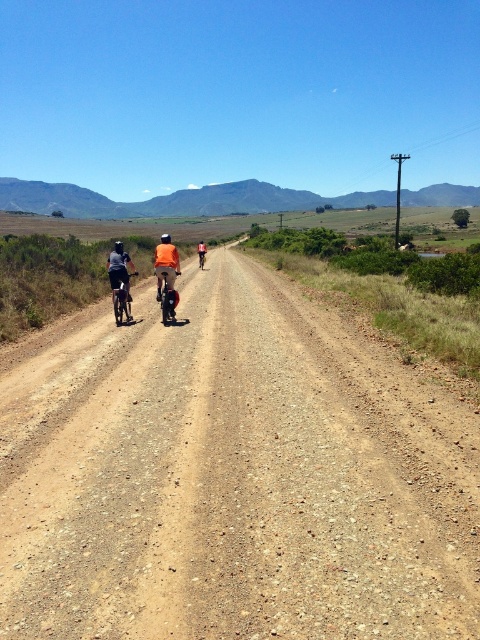
You are standing at the starting point of the dirt road and see the shiny metallic bicycle at center and the matte black bicycle at left. Which bicycle is closer to you?

The matte black bicycle at left is closer to you because the shiny metallic bicycle at center is located above it, indicating it is further along the road.

Looking at this image, you are a cyclist planning to ride along the brown gravel road at center. You notice the matte black bicycle at left parked on the side of the road. Can you safely ride your bicycle along the road without worrying about the width of the road being too narrow?

The brown gravel road at center is wider than the matte black bicycle at left, so the road is wide enough to safely ride your bicycle along it.

You are a hiker standing on the brown gravel road at center and want to reach the matte black bicycle at left. Which direction should you move to get there?

The brown gravel road at center is below the matte black bicycle at left, so you should move upward to reach the matte black bicycle at left.